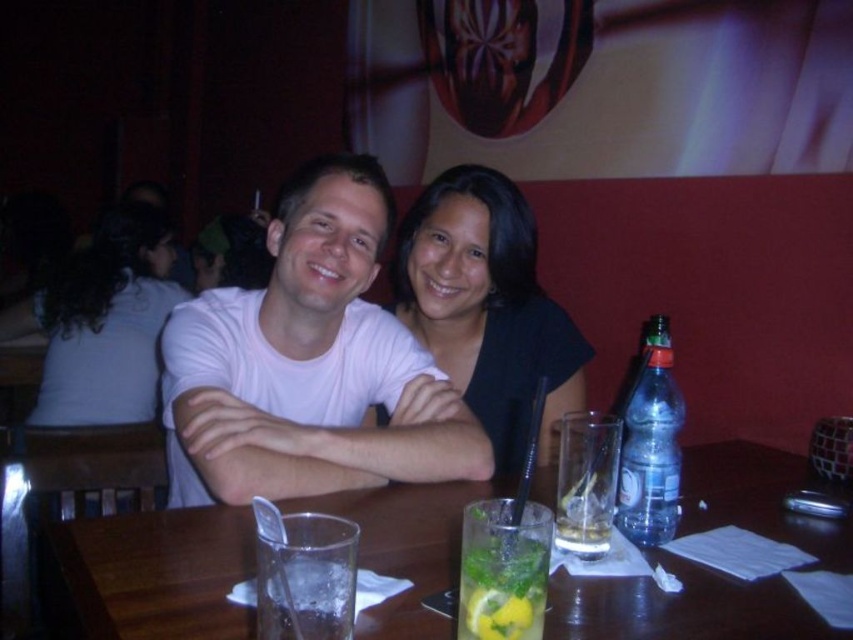
You are standing at the origin point in the dining area and want to reach the point marked as point (407, 490). Which direction should you move relative to point (648, 442)?

Since point (407, 490) is behind point (648, 442), you should move in the direction away from point (648, 442) to reach it.

You are a waiter in a restaurant. You need to deliver a new drink to the transparent glass at center. Where exactly should you place the new drink relative to the other items on the table?

The transparent glass at center is located at point (x=148, y=576), so you should place the new drink precisely at that coordinate to ensure it reaches the correct location.

You are a waiter in a restaurant and need to place a new drink order for the customer. The drink should be placed exactly where the transparent glass at center is located. What are the coordinates for placing the new drink?

The coordinates for placing the new drink should be at point (148,576), as that is the 2D location of the transparent glass at center.